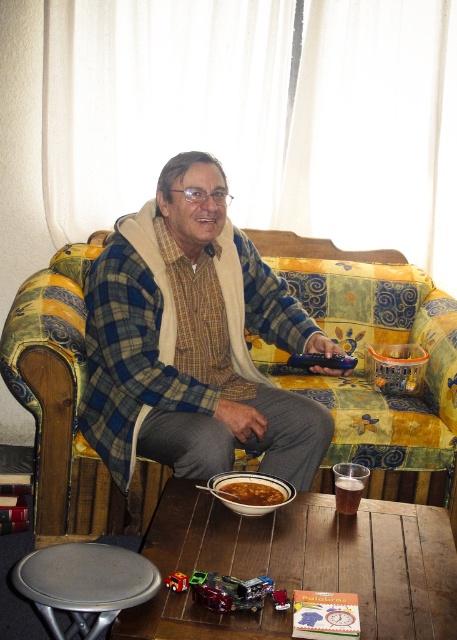
Question: Can you confirm if gray fabric stool at lower left is smaller than brown matte bowl at lower center?

Choices:
 (A) yes
 (B) no

Answer: (B)

Question: Among these points, which one is farthest from the camera?

Choices:
 (A) (96, 588)
 (B) (264, 465)
 (C) (10, 348)
 (D) (359, 481)

Answer: (C)

Question: Is wooden table at center further to camera compared to brown matte bowl at lower center?

Choices:
 (A) yes
 (B) no

Answer: (B)

Question: Which object appears farthest from the camera in this image?

Choices:
 (A) plaid fabric man at center
 (B) brown matte bowl at lower center
 (C) yellow floral fabric couch at center

Answer: (C)

Question: Which object appears farthest from the camera in this image?

Choices:
 (A) gray fabric stool at lower left
 (B) yellow floral fabric couch at center
 (C) plaid fabric man at center

Answer: (B)

Question: Is wooden table at center to the right of brown matte bowl at lower center from the viewer's perspective?

Choices:
 (A) yes
 (B) no

Answer: (A)